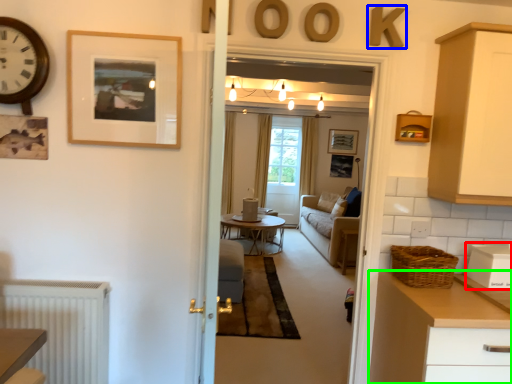
Question: Which object is the closest to the appliance (highlighted by a red box)? Choose among these: letter (highlighted by a blue box) or chest of drawers (highlighted by a green box).

Choices:
 (A) letter
 (B) chest of drawers

Answer: (B)